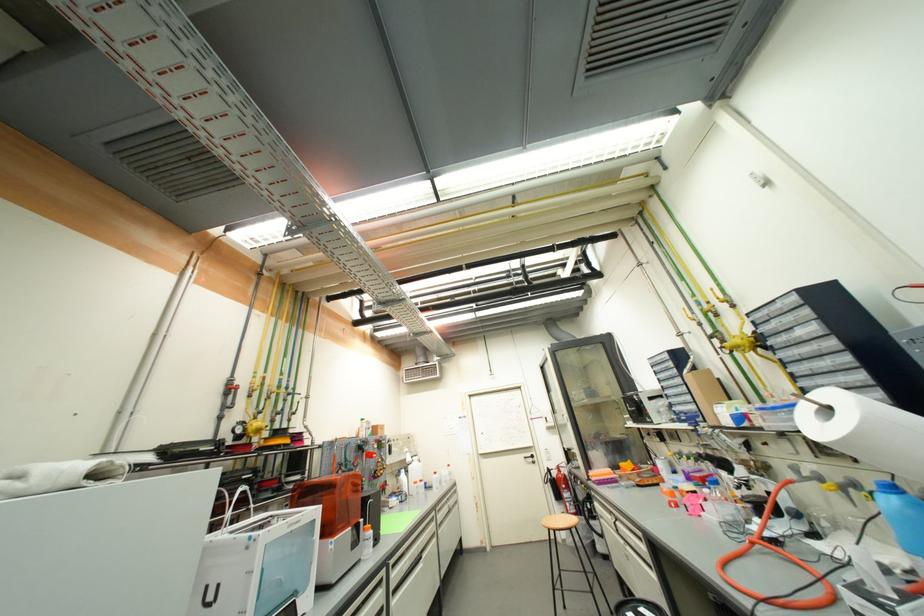
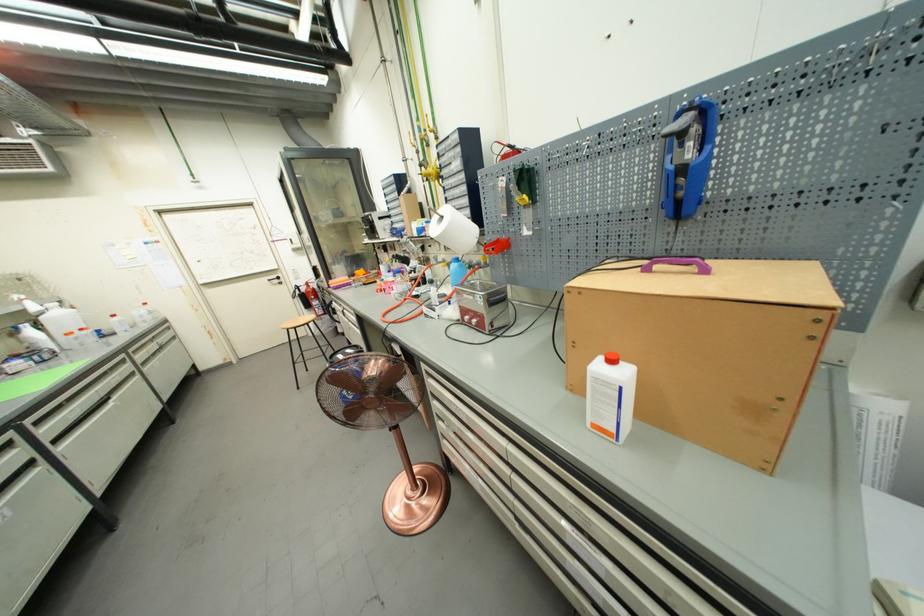
The point at (889,493) is marked in the first image. Where is the corresponding point in the second image?

(458, 264)